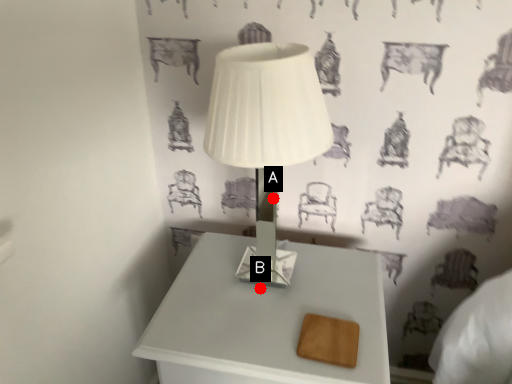
Question: Two points are circled on the image, labeled by A and B beside each circle. Which point is closer to the camera?

Choices:
 (A) A is closer
 (B) B is closer

Answer: (B)